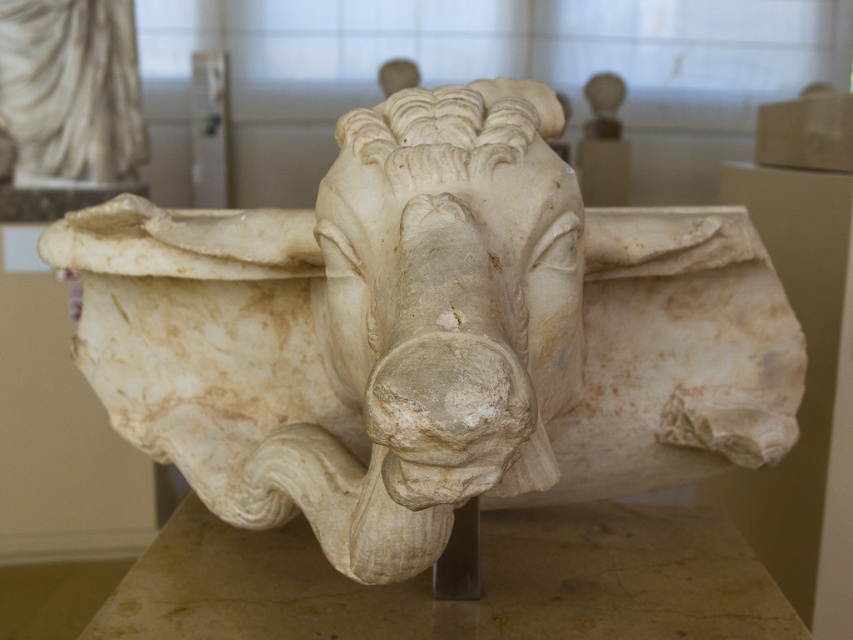
You are a museum curator planning to install a new spotlight at point (432, 333). Which object should the spotlight be directed towards?

The white marble bull at center is located at point (432, 333), so the spotlight should be directed towards the white marble bull at center.

You are an art student standing in front of the sculpture. You notice two parts of the sculpture labeled as the white marble bull at center and the white marble bull head at center. Which part of the sculpture is closer to you?

The white marble bull at center is closer to you because it is further to the viewer than the white marble bull head at center.

You are a tour guide explaining the layout of the museum. Where is the white marble bull at center located in terms of coordinates?

The white marble bull at center is located at coordinates point (432, 333).